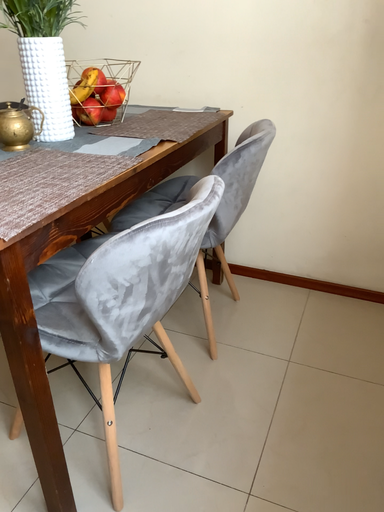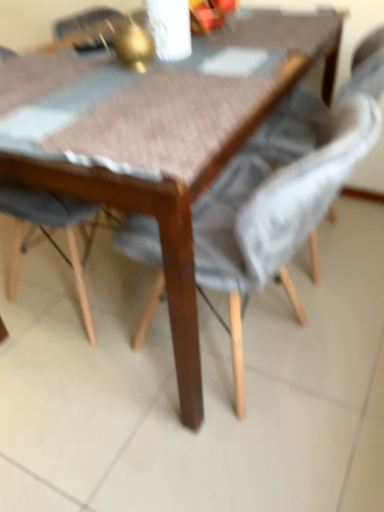
Question: How did the camera likely rotate when shooting the video?

Choices:
 (A) rotated upward
 (B) rotated downward

Answer: (B)